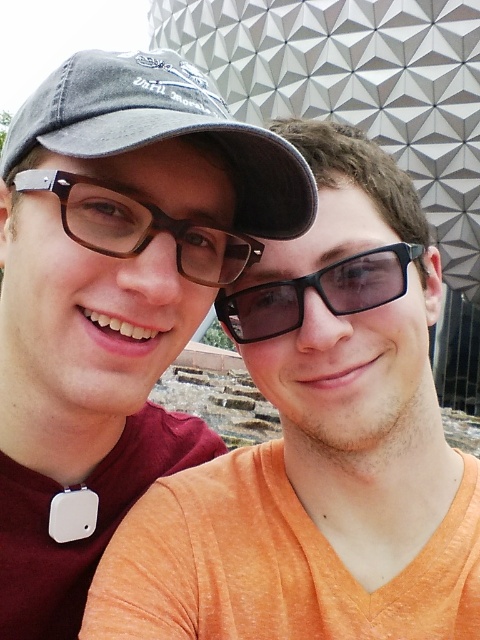
Question: In this image, where is matte black cap at upper left located relative to black plastic goggles at center?

Choices:
 (A) above
 (B) below

Answer: (B)

Question: Which object is the closest to the denim baseball cap at upper left?

Choices:
 (A) black plastic goggles at center
 (B) brown matte glasses at center
 (C) matte black cap at upper left
 (D) matte black glasses at left

Answer: (B)

Question: Can you confirm if denim baseball cap at upper left is smaller than black plastic goggles at center?

Choices:
 (A) no
 (B) yes

Answer: (A)

Question: Estimate the real-world distances between objects in this image. Which object is closer to the black plastic goggles at center?

Choices:
 (A) matte black cap at upper left
 (B) matte black glasses at left

Answer: (B)

Question: Does matte black cap at upper left appear under denim baseball cap at upper left?

Choices:
 (A) yes
 (B) no

Answer: (A)

Question: Which point is closer to the camera?

Choices:
 (A) (10, 488)
 (B) (173, 236)

Answer: (B)